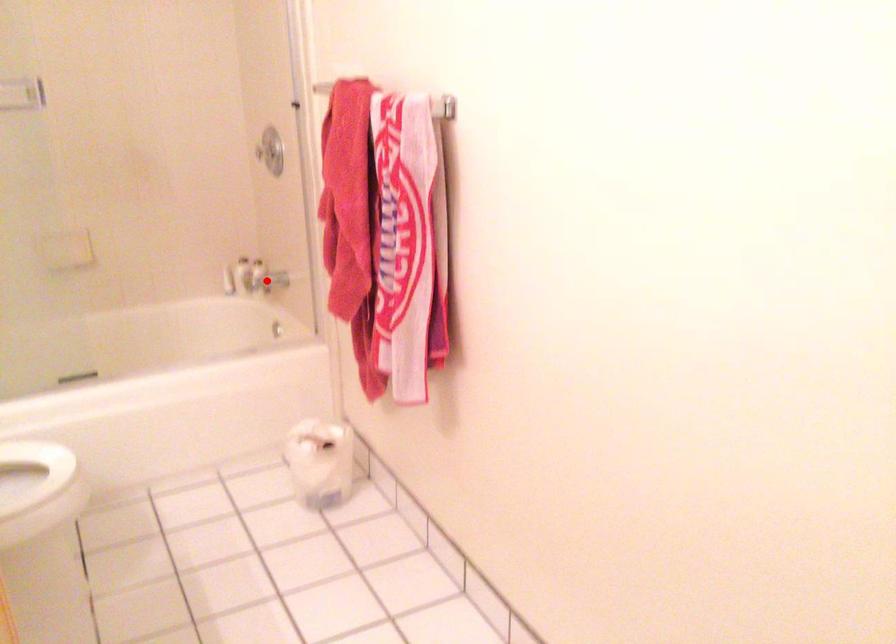
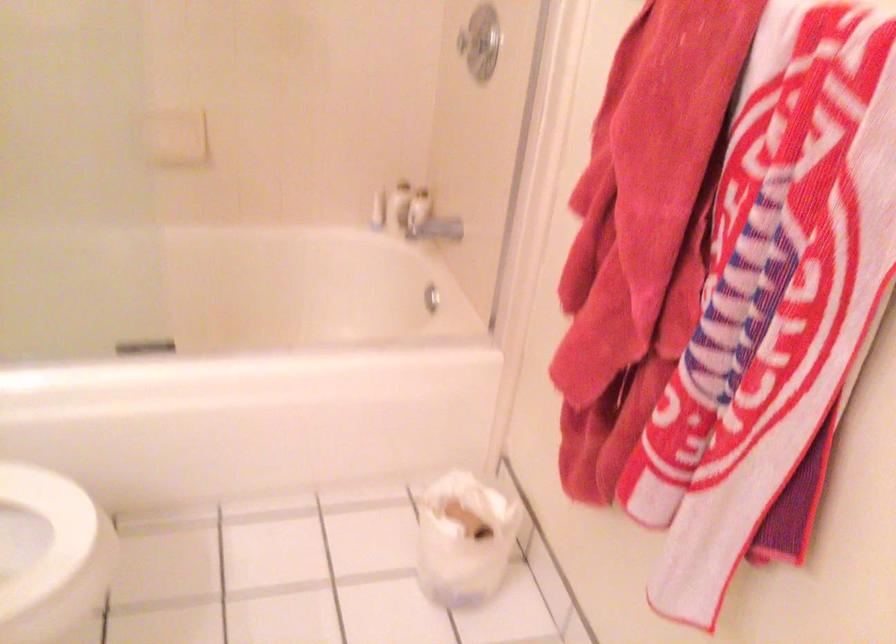
Where in the second image is the point corresponding to the highlighted location from the first image?

(429, 221)